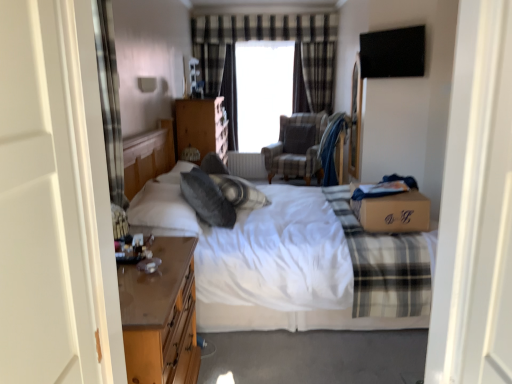
Question: In the image, is plaid fabric at right positioned in front of or behind transparent glass window at center?

Choices:
 (A) behind
 (B) front

Answer: (B)

Question: Would you say plaid fabric at right is to the left or to the right of transparent glass window at center in the picture?

Choices:
 (A) left
 (B) right

Answer: (B)

Question: Which of these objects is positioned farthest from the white plastic radiator at center?

Choices:
 (A) wooden chest of drawers at center
 (B) plaid fabric curtain at upper center
 (C) plaid fabric armchair at center
 (D) white cotton bed at center
 (E) gray soft pillow at center, marked as the 1th pillow in a back-to-front arrangement

Answer: (D)

Question: Which of these objects is positioned farthest from the plaid fabric armchair at center?

Choices:
 (A) gray soft pillow at center, the first pillow in the bottom-to-top sequence
 (B) transparent glass window at center
 (C) white plastic radiator at center
 (D) plaid fabric at right
 (E) wooden nightstand at lower left

Answer: (E)